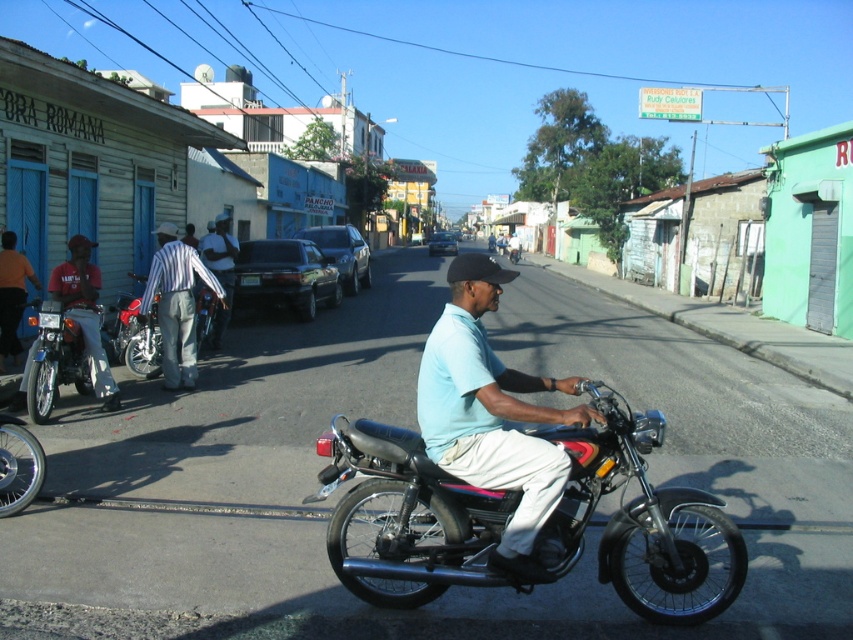
Can you confirm if shiny black motorcycle at center is bigger than light blue fabric shirt at center?

Actually, shiny black motorcycle at center might be smaller than light blue fabric shirt at center.

Consider the image. Can you confirm if shiny black motorcycle at center is thinner than light blue fabric shirt at center?

In fact, shiny black motorcycle at center might be wider than light blue fabric shirt at center.

Identify the location of shiny black motorcycle at center. (640, 518).

How much distance is there between light blue fabric shirt at center and striped fabric pants at left?

A distance of 12.64 feet exists between light blue fabric shirt at center and striped fabric pants at left.

Can you confirm if light blue fabric shirt at center is positioned below striped fabric pants at left?

Yes.

Is point (550, 468) positioned before point (193, 340)?

Yes, point (550, 468) is in front of point (193, 340).

Find the location of a particular element. light blue fabric shirt at center is located at coordinates (492, 413).

The image size is (853, 640). I want to click on striped fabric pants at left, so click(x=177, y=305).

Where is `striped fabric pants at left`? striped fabric pants at left is located at coordinates (177, 305).